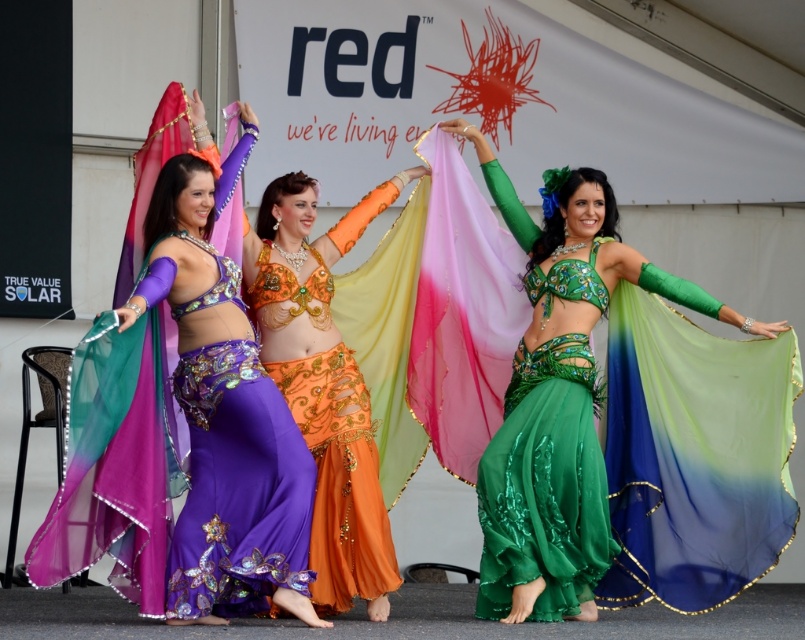
Based on the photo, you are a photographer standing at the front of the stage where the three belly dancers are performing. You want to take a photo that includes both the point at point (176, 616) and the point at point (303, 230). Which point should you focus on first to ensure both are in clear focus?

You should focus on point (176, 616) first because it is closer to you than point (303, 230), and adjusting focus from near to far will help ensure both points are in clear focus.